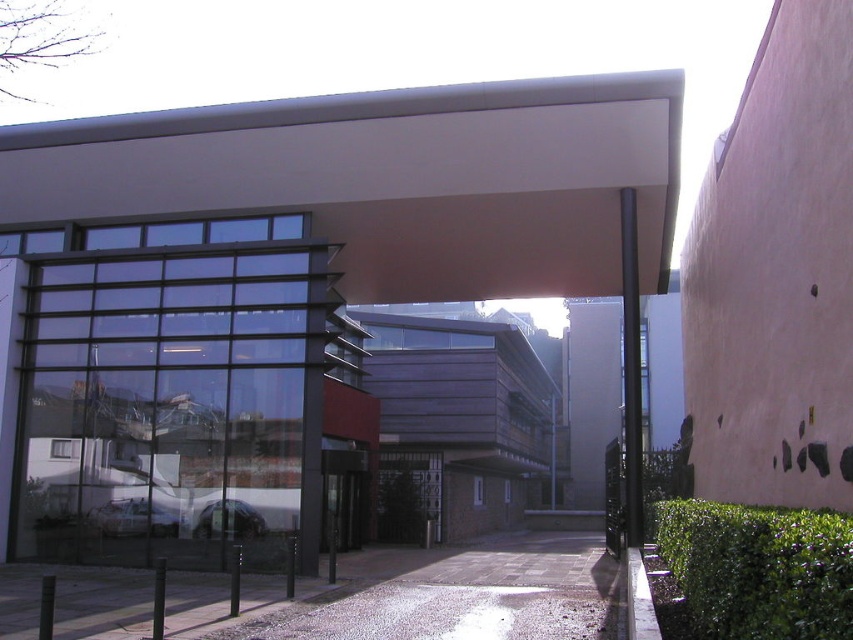
You are standing at the entrance of the modern building and want to locate the black glass door at center. According to the coordinates provided, where exactly should you look to find it?

The black glass door at center is located at point coordinates of 0.772 in the x axis and 0.403 in the y axis.

From the picture: You are a delivery person approaching the entrance of the building. You need to determine if your 2.5 meters tall package can fit through the entrance. The entrance has a black glass door at center and a metallic silver car at center. Which object determines the maximum height your package can be?

The black glass door at center is taller than the metallic silver car at center, so the maximum height your package can be is determined by the height of the black glass door at center.

You are standing at the entrance of the building and see two points marked on the ground. The first point is at coordinates point (335, 468) and the second point is at point (207, 502). Which point is closer to you as you face the building?

Point (207, 502) is closer to you because it is in front of point (335, 468), which is behind it.